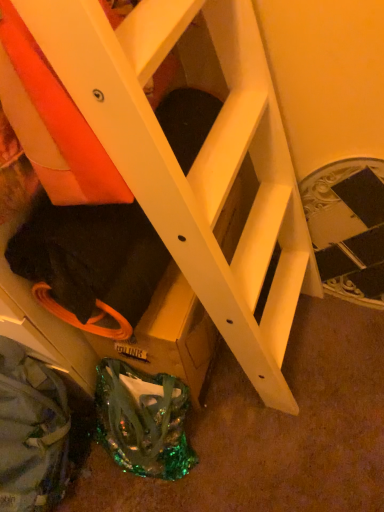
Question: Relative to shiny green fabric bag at lower center, is black textured stairwell at center in front or behind?

Choices:
 (A) behind
 (B) front

Answer: (A)

Question: From a real-world perspective, is black textured stairwell at center positioned above or below shiny green fabric bag at lower center?

Choices:
 (A) below
 (B) above

Answer: (B)

Question: Would you say black textured stairwell at center is to the left or to the right of shiny green fabric bag at lower center in the picture?

Choices:
 (A) left
 (B) right

Answer: (B)

Question: Would you say shiny green fabric bag at lower center is to the left or to the right of black textured stairwell at center in the picture?

Choices:
 (A) right
 (B) left

Answer: (B)

Question: Is point (163, 428) positioned closer to the camera than point (369, 291)?

Choices:
 (A) closer
 (B) farther

Answer: (A)

Question: In terms of size, does shiny green fabric bag at lower center appear bigger or smaller than black textured stairwell at center?

Choices:
 (A) small
 (B) big

Answer: (B)

Question: From a real-world perspective, is shiny green fabric bag at lower center above or below black textured stairwell at center?

Choices:
 (A) above
 (B) below

Answer: (B)